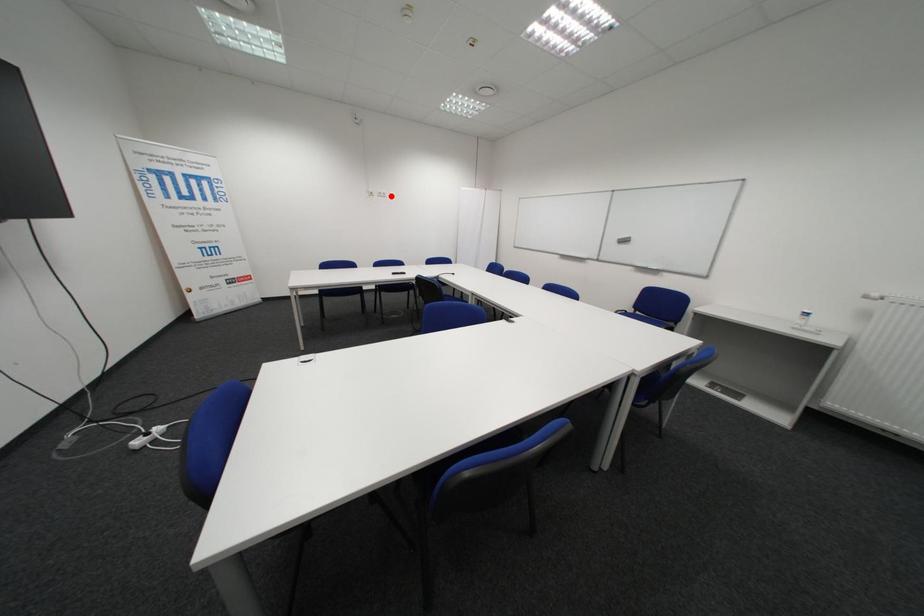
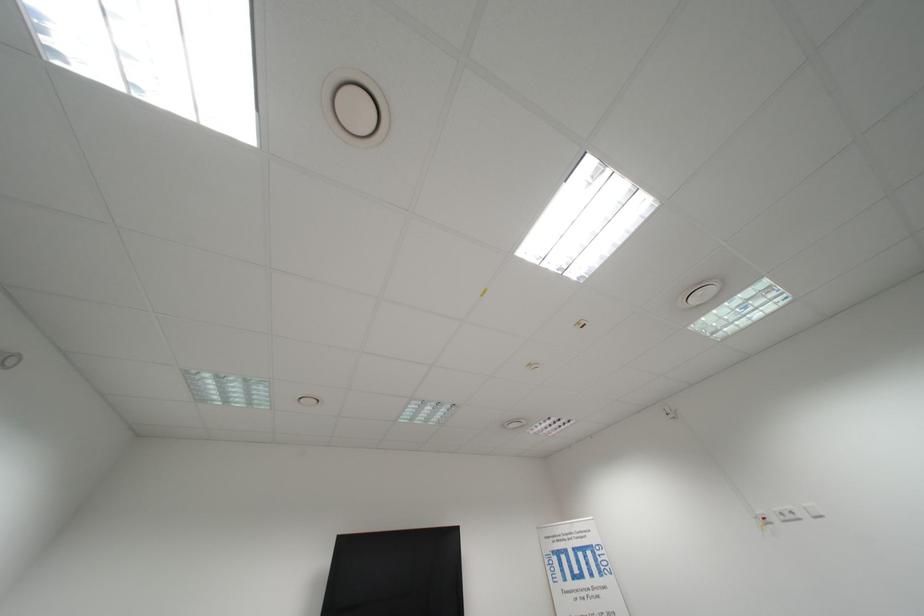
Find the pixel in the second image that matches the highlighted location in the first image.

(796, 519)